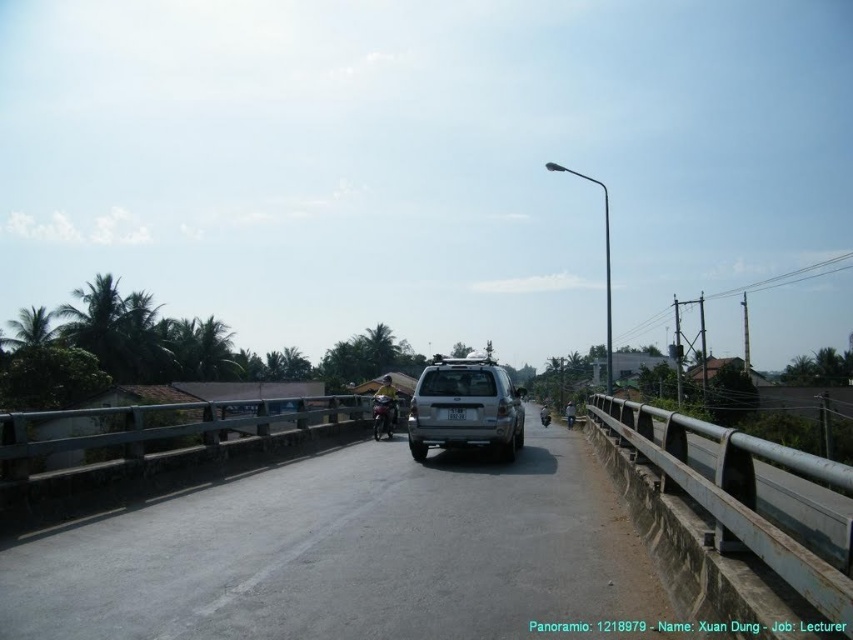
How distant is gray concrete highway at center from metallic gray rail at right?

71.21 meters

Is the position of gray concrete highway at center more distant than that of metallic gray rail at right?

Yes, it is.

Which is in front, point (482, 588) or point (842, 576)?

Point (842, 576) is in front.

Find the location of a particular element. The height and width of the screenshot is (640, 853). gray concrete highway at center is located at coordinates (349, 554).

Between metallic gray rail at center and metallic silver motorcycle at center, which one appears on the left side from the viewer's perspective?

metallic gray rail at center is more to the left.

Which is behind, point (283, 419) or point (397, 410)?

The point (397, 410) is more distant.

The width and height of the screenshot is (853, 640). Identify the location of metallic gray rail at center. (151, 433).

At what (x,y) coordinates should I click in order to perform the action: click on metallic gray rail at center. Please return your answer as a coordinate pair (x, y). The width and height of the screenshot is (853, 640). Looking at the image, I should click on (151, 433).

Where is `gray concrete highway at center`? gray concrete highway at center is located at coordinates (349, 554).

Which is behind, point (160, 552) or point (497, 419)?

The point (497, 419) is behind.

Find the location of a particular element. The height and width of the screenshot is (640, 853). gray concrete highway at center is located at coordinates (349, 554).